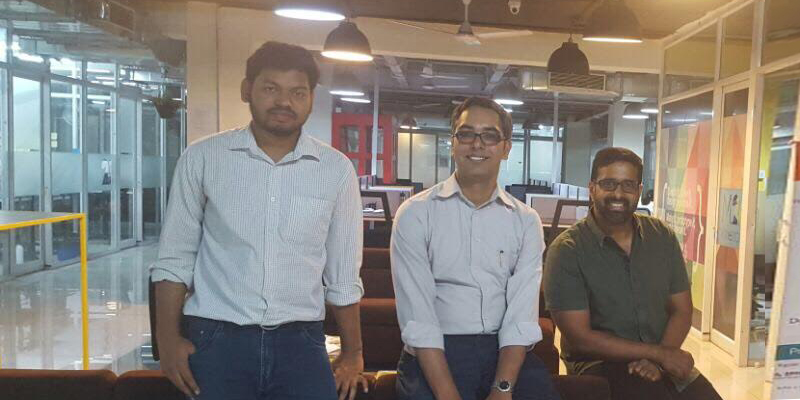
In order to click on red wall in this screenshot , I will do `click(358, 117)`.